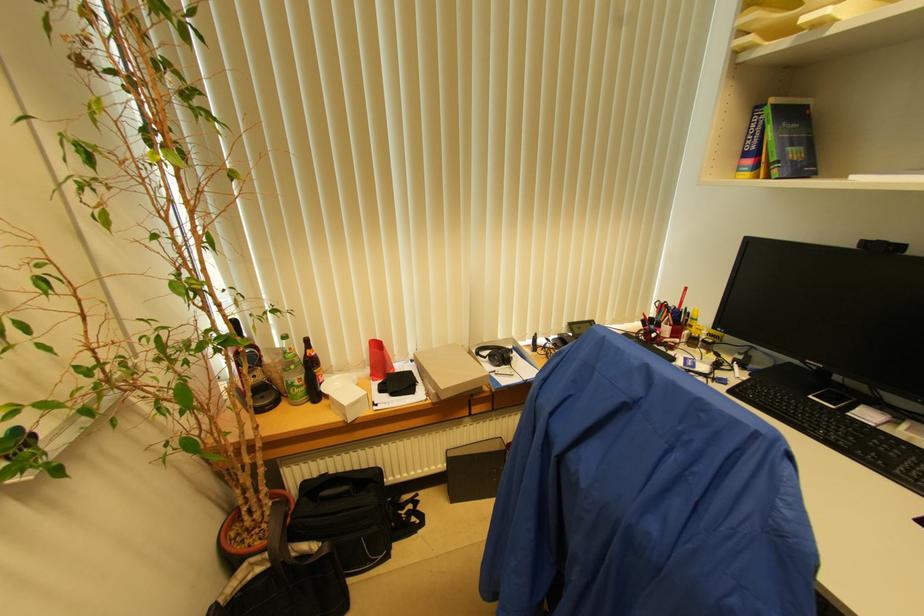
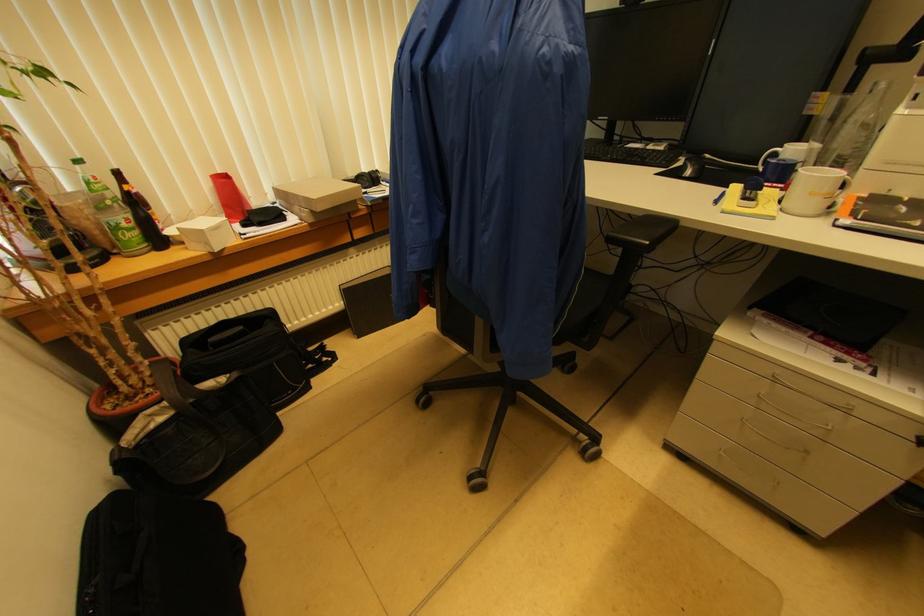
In a continuous first-person perspective shot, in which direction is the camera moving?

The cameraman walked toward left, backward.